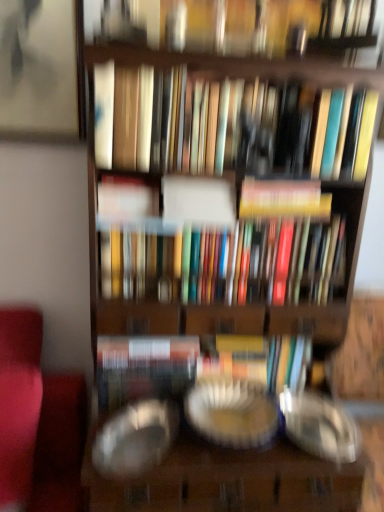
Describe the element at coordinates (231, 414) in the screenshot. I see `transparent glass plate at center, positioned as the second glass plate in left-to-right order` at that location.

Image resolution: width=384 pixels, height=512 pixels. What do you see at coordinates (126, 198) in the screenshot? I see `matte white book at center, acting as the second book starting from the top` at bounding box center [126, 198].

The height and width of the screenshot is (512, 384). Find the location of `matte white book at center, acting as the second book starting from the top`. matte white book at center, acting as the second book starting from the top is located at coordinates (126, 198).

Locate an element on the screen. transparent glass plate at center, which ranks as the second glass plate in right-to-left order is located at coordinates (135, 439).

Locate an element on the screen. multicolored hardcover books at center, arranged as the first book when ordered from the bottom is located at coordinates (226, 260).

Looking at this image, what is the approximate height of matte hardcover books at center, which appears as the fourth book when ordered from the bottom?

matte hardcover books at center, which appears as the fourth book when ordered from the bottom, is 8.93 inches in height.

At what (x,y) coordinates should I click in order to perform the action: click on transparent glass plate at center, positioned as the second glass plate in left-to-right order. Please return your answer as a coordinate pair (x, y). The image size is (384, 512). Looking at the image, I should click on [231, 414].

Could you tell me if transparent glass plate at center, the 1th glass plate viewed from the left, is facing multicolored hardcover books at center, arranged as the first book when ordered from the bottom?

No.

Considering the relative sizes of transparent glass plate at center, which ranks as the second glass plate in right-to-left order, and multicolored hardcover books at center, arranged as the first book when ordered from the bottom, in the image provided, is transparent glass plate at center, which ranks as the second glass plate in right-to-left order, wider than multicolored hardcover books at center, arranged as the first book when ordered from the bottom,?

Indeed, transparent glass plate at center, which ranks as the second glass plate in right-to-left order, has a greater width compared to multicolored hardcover books at center, arranged as the first book when ordered from the bottom.

Which of these two, transparent glass plate at center, the 1th glass plate viewed from the left, or multicolored hardcover books at center, arranged as the first book when ordered from the bottom, stands taller?

With more height is multicolored hardcover books at center, arranged as the first book when ordered from the bottom.

Considering the sizes of transparent glass plate at center, positioned as the second glass plate in left-to-right order, and hardcover book at center, positioned as the second book in bottom-to-top order, in the image, is transparent glass plate at center, positioned as the second glass plate in left-to-right order, wider or thinner than hardcover book at center, positioned as the second book in bottom-to-top order,?

transparent glass plate at center, positioned as the second glass plate in left-to-right order, is wider than hardcover book at center, positioned as the second book in bottom-to-top order.

Considering the sizes of objects transparent glass plate at center, positioned as the second glass plate in left-to-right order, and hardcover book at center, positioned as the second book in bottom-to-top order, in the image provided, who is smaller, transparent glass plate at center, positioned as the second glass plate in left-to-right order, or hardcover book at center, positioned as the second book in bottom-to-top order,?

hardcover book at center, positioned as the second book in bottom-to-top order, is smaller.

Is transparent glass plate at center, positioned as the second glass plate in left-to-right order, far from hardcover book at center, marked as the third book in a top-to-bottom arrangement?

No, transparent glass plate at center, positioned as the second glass plate in left-to-right order, is in close proximity to hardcover book at center, marked as the third book in a top-to-bottom arrangement.

Considering the positions of objects matte hardcover book at center and transparent glass plate at center, positioned as the second glass plate in left-to-right order, in the image provided, who is in front, matte hardcover book at center or transparent glass plate at center, positioned as the second glass plate in left-to-right order,?

transparent glass plate at center, positioned as the second glass plate in left-to-right order.

From the picture: What's the angular difference between matte hardcover book at center and transparent glass plate at center, positioned as the second glass plate in left-to-right order,'s facing directions?

There is a 0.000166-degree angle between the facing directions of matte hardcover book at center and transparent glass plate at center, positioned as the second glass plate in left-to-right order.

Can you confirm if matte hardcover book at center is taller than transparent glass plate at center, the first glass plate positioned from the right?

Yes.

Which is closer, (114, 377) or (184, 401)?

Point (114, 377) appears to be farther away from the viewer than point (184, 401).

Is matte hardcover books at center, positioned as the 1th book in top-to-bottom order, taller or shorter than multicolored hardcover books at center, arranged as the fourth book when viewed from the top?

In the image, matte hardcover books at center, positioned as the 1th book in top-to-bottom order, appears to be shorter than multicolored hardcover books at center, arranged as the fourth book when viewed from the top.

From the image's perspective, between matte hardcover books at center, positioned as the 1th book in top-to-bottom order, and multicolored hardcover books at center, arranged as the first book when ordered from the bottom, who is located below?

multicolored hardcover books at center, arranged as the first book when ordered from the bottom, is shown below in the image.

Is matte hardcover books at center, positioned as the 1th book in top-to-bottom order, positioned before multicolored hardcover books at center, arranged as the first book when ordered from the bottom?

Yes, it is in front of multicolored hardcover books at center, arranged as the first book when ordered from the bottom.

Choose the correct answer: Is matte hardcover books at center, positioned as the 1th book in top-to-bottom order, inside multicolored hardcover books at center, arranged as the first book when ordered from the bottom, or outside it?

matte hardcover books at center, positioned as the 1th book in top-to-bottom order, cannot be found inside multicolored hardcover books at center, arranged as the first book when ordered from the bottom.

Can you tell me how much multicolored hardcover books at center, arranged as the fourth book when viewed from the top, and transparent glass plate at center, the first glass plate positioned from the right, differ in facing direction?

The facing directions of multicolored hardcover books at center, arranged as the fourth book when viewed from the top, and transparent glass plate at center, the first glass plate positioned from the right, are 0.0622 degrees apart.

From the picture: From a real-world perspective, is multicolored hardcover books at center, arranged as the fourth book when viewed from the top, positioned above or below transparent glass plate at center, positioned as the second glass plate in left-to-right order?

multicolored hardcover books at center, arranged as the fourth book when viewed from the top, is above transparent glass plate at center, positioned as the second glass plate in left-to-right order.

Measure the distance from multicolored hardcover books at center, arranged as the first book when ordered from the bottom, to transparent glass plate at center, positioned as the second glass plate in left-to-right order.

multicolored hardcover books at center, arranged as the first book when ordered from the bottom, is 38.33 centimeters from transparent glass plate at center, positioned as the second glass plate in left-to-right order.

Consider the image. Which of these two, multicolored hardcover books at center, arranged as the fourth book when viewed from the top, or transparent glass plate at center, positioned as the second glass plate in left-to-right order, is wider?

transparent glass plate at center, positioned as the second glass plate in left-to-right order.

From a real-world perspective, is hardcover book at center, positioned as the second book in bottom-to-top order, above or below matte hardcover book at center?

hardcover book at center, positioned as the second book in bottom-to-top order, is above matte hardcover book at center.

Relative to matte hardcover book at center, is hardcover book at center, marked as the third book in a top-to-bottom arrangement, in front or behind?

In the image, hardcover book at center, marked as the third book in a top-to-bottom arrangement, appears in front of matte hardcover book at center.

Is hardcover book at center, marked as the third book in a top-to-bottom arrangement, smaller than matte hardcover book at center?

Yes.

Which is in front, point (249, 209) or point (146, 392)?

Point (249, 209)

Is transparent glass plate at center, the 1th glass plate viewed from the left, not close to hardcover book at center, marked as the third book in a top-to-bottom arrangement?

That's not correct — transparent glass plate at center, the 1th glass plate viewed from the left, is a little close to hardcover book at center, marked as the third book in a top-to-bottom arrangement.

Image resolution: width=384 pixels, height=512 pixels. In order to click on the 3rd book behind the transparent glass plate at center, the 1th glass plate viewed from the left in this screenshot , I will do `click(283, 199)`.

From a real-world perspective, between transparent glass plate at center, the 1th glass plate viewed from the left, and hardcover book at center, positioned as the second book in bottom-to-top order, who is vertically lower?

In real-world perspective, transparent glass plate at center, the 1th glass plate viewed from the left, is lower.

Is transparent glass plate at center, which ranks as the second glass plate in right-to-left order, oriented towards hardcover book at center, marked as the third book in a top-to-bottom arrangement?

No, transparent glass plate at center, which ranks as the second glass plate in right-to-left order, does not turn towards hardcover book at center, marked as the third book in a top-to-bottom arrangement.

The image size is (384, 512). What are the coordinates of `the 1st book above the transparent glass plate at center, which ranks as the second glass plate in right-to-left order (from the image's perspective)` in the screenshot? It's located at (226, 260).

This screenshot has width=384, height=512. In order to click on the 1st glass plate in front of the hardcover book at center, positioned as the second book in bottom-to-top order in this screenshot , I will do `click(231, 414)`.

Estimate the real-world distances between objects in this image. Which object is further from transparent glass plate at center, the first glass plate positioned from the right, matte white book at center, acting as the second book starting from the top, or multicolored hardcover books at center, arranged as the fourth book when viewed from the top?

matte white book at center, acting as the second book starting from the top, is further to transparent glass plate at center, the first glass plate positioned from the right.

Considering their positions, is matte hardcover book at center positioned further to matte hardcover books at center, positioned as the 1th book in top-to-bottom order, than transparent glass plate at center, the first glass plate positioned from the right?

transparent glass plate at center, the first glass plate positioned from the right, is further to matte hardcover books at center, positioned as the 1th book in top-to-bottom order.

Considering their positions, is matte white book at center, which is the third book from bottom to top, positioned closer to transparent glass plate at center, the 1th glass plate viewed from the left, than hardcover book at center, positioned as the second book in bottom-to-top order?

matte white book at center, which is the third book from bottom to top, is closer to transparent glass plate at center, the 1th glass plate viewed from the left.

Estimate the real-world distances between objects in this image. Which object is closer to matte hardcover books at center, which appears as the fourth book when ordered from the bottom, matte hardcover book at center or multicolored hardcover books at center, arranged as the first book when ordered from the bottom?

multicolored hardcover books at center, arranged as the first book when ordered from the bottom, is positioned closer to the anchor matte hardcover books at center, which appears as the fourth book when ordered from the bottom.

Looking at the image, which one is located closer to matte hardcover book at center, multicolored hardcover books at center, arranged as the first book when ordered from the bottom, or matte hardcover books at center, positioned as the 1th book in top-to-bottom order?

multicolored hardcover books at center, arranged as the first book when ordered from the bottom.

Looking at the image, which one is located closer to hardcover book at center, positioned as the second book in bottom-to-top order, transparent glass plate at center, which ranks as the second glass plate in right-to-left order, or multicolored hardcover books at center, arranged as the fourth book when viewed from the top?

multicolored hardcover books at center, arranged as the fourth book when viewed from the top, lies closer to hardcover book at center, positioned as the second book in bottom-to-top order, than the other object.

Considering their positions, is matte white book at center, acting as the second book starting from the top, positioned further to multicolored hardcover books at center, arranged as the first book when ordered from the bottom, than matte hardcover book at center?

Among the two, matte hardcover book at center is located further to multicolored hardcover books at center, arranged as the first book when ordered from the bottom.

Which object lies further to the anchor point transparent glass plate at center, which ranks as the second glass plate in right-to-left order, matte white book at center, which is the third book from bottom to top, or matte hardcover book at center?

Based on the image, matte white book at center, which is the third book from bottom to top, appears to be further to transparent glass plate at center, which ranks as the second glass plate in right-to-left order.

The height and width of the screenshot is (512, 384). I want to click on paperback book between matte white book at center, which is the third book from bottom to top, and transparent glass plate at center, which ranks as the second glass plate in right-to-left order, in the up-down direction, so click(x=143, y=367).

Image resolution: width=384 pixels, height=512 pixels. I want to click on book between hardcover book at center, marked as the third book in a top-to-bottom arrangement, and matte hardcover book at center vertically, so click(226, 260).

The image size is (384, 512). What are the coordinates of `glass plate situated between matte hardcover book at center and transparent glass plate at center, the first glass plate positioned from the right, from left to right` in the screenshot? It's located at (135, 439).

The height and width of the screenshot is (512, 384). I want to click on paperback book between multicolored hardcover books at center, arranged as the fourth book when viewed from the top, and transparent glass plate at center, the first glass plate positioned from the right, in the vertical direction, so click(x=143, y=367).